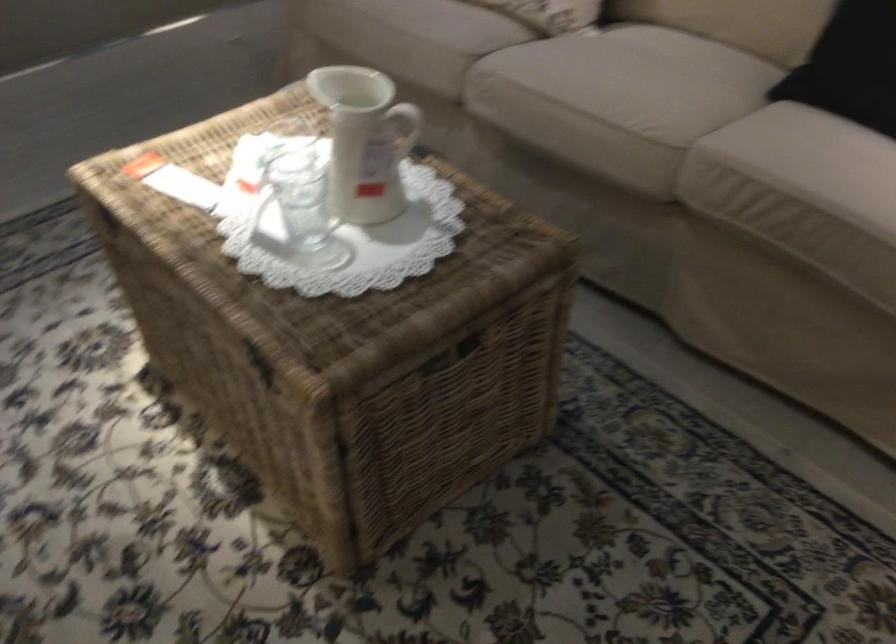
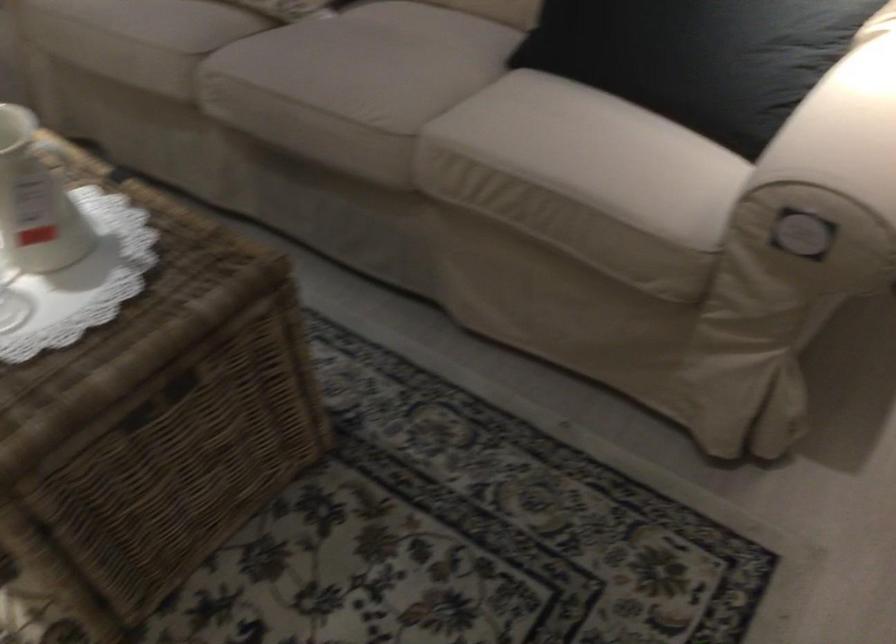
Question: The camera is either moving clockwise (left) or counter-clockwise (right) around the object. The first image is from the beginning of the video and the second image is from the end. Is the camera moving left or right when shooting the video?

Choices:
 (A) Left
 (B) Right

Answer: (A)